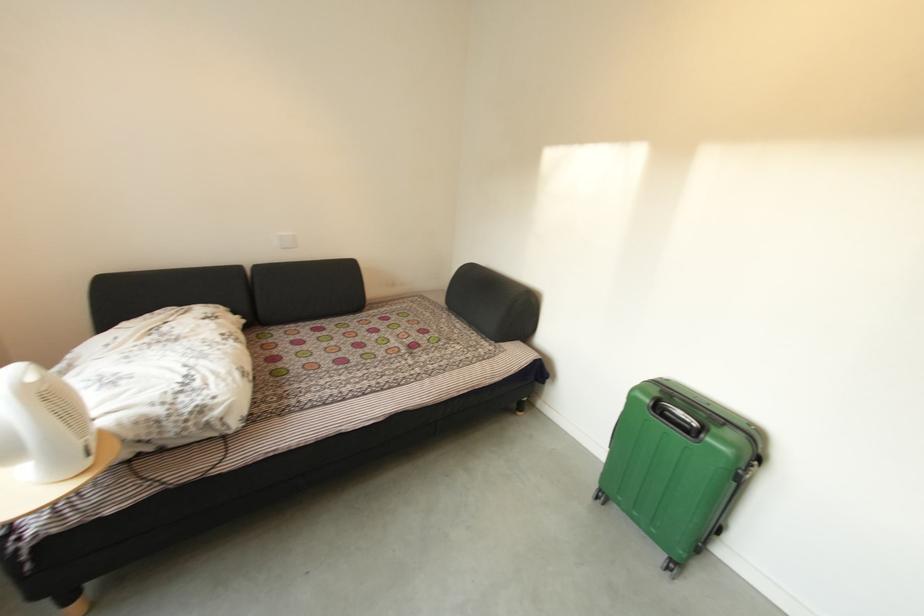
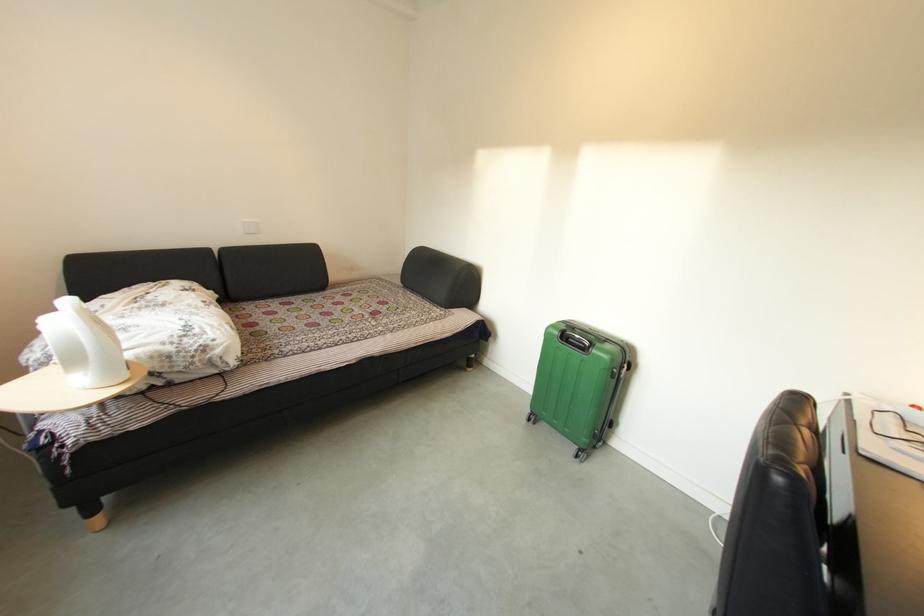
Find the pixel in the second image that matches (387,314) in the first image.

(349, 293)